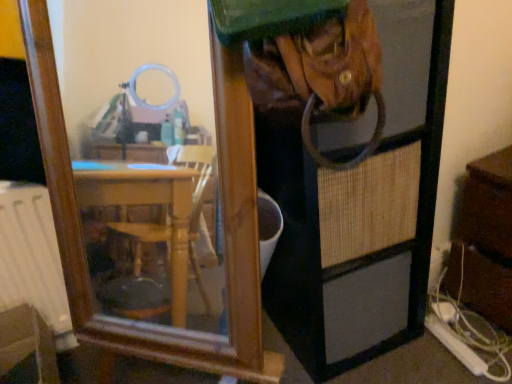
The image size is (512, 384). In order to click on brown wooden dresser at right in this screenshot , I will do `click(484, 240)`.

Measure the distance between brown wooden dresser at right and camera.

brown wooden dresser at right and camera are 1.22 meters apart.

Identify the location of brown woven screen door at center. (351, 175).

This screenshot has width=512, height=384. Identify the location of brown wooden dresser at right. (484, 240).

This screenshot has width=512, height=384. In the image, there is a brown woven screen door at center. What are the coordinates of `dresser below it (from the image's perspective)` in the screenshot? It's located at (484, 240).

From the picture: Is brown woven screen door at center positioned beyond the bounds of brown wooden dresser at right?

Absolutely, brown woven screen door at center is external to brown wooden dresser at right.

Is brown woven screen door at center aimed at brown wooden dresser at right?

No, brown woven screen door at center is not aimed at brown wooden dresser at right.

From a real-world perspective, between brown woven screen door at center and brown wooden dresser at right, who is vertically higher?

From a 3D spatial view, brown woven screen door at center is above.

Is brushed metal water at lower left aimed at brown wooden dresser at right?

No, brushed metal water at lower left is not turned towards brown wooden dresser at right.

From a real-world perspective, which object rests below the other?

brushed metal water at lower left, from a real-world perspective.

Find the location of a particular element. The image size is (512, 384). furniture below the brown wooden dresser at right (from the image's perspective) is located at coordinates (26, 347).

How many degrees apart are the facing directions of brushed metal water at lower left and brown wooden dresser at right?

brushed metal water at lower left and brown wooden dresser at right are facing 89.1 degrees away from each other.

Is brown wooden dresser at right oriented away from brown woven screen door at center?

No, brown wooden dresser at right is not facing away from brown woven screen door at center.

Considering the relative sizes of brown wooden dresser at right and brown woven screen door at center in the image provided, is brown wooden dresser at right wider than brown woven screen door at center?

Correct, the width of brown wooden dresser at right exceeds that of brown woven screen door at center.

From the image's perspective, between brown wooden dresser at right and brown woven screen door at center, which one is located above?

brown woven screen door at center appears higher in the image.

Are brown wooden dresser at right and brown woven screen door at center located far from each other?

No, brown wooden dresser at right is not far from brown woven screen door at center.

Does point (41, 378) appear closer or farther from the camera than point (318, 79)?

Clearly, point (41, 378) is more distant from the camera than point (318, 79).

Locate an element on the screen. The width and height of the screenshot is (512, 384). furniture below the brown woven screen door at center (from the image's perspective) is located at coordinates (26, 347).

Is the position of brushed metal water at lower left more distant than that of brown woven screen door at center?

That is True.

From the image's perspective, is brushed metal water at lower left on brown woven screen door at center?

Actually, brushed metal water at lower left appears below brown woven screen door at center in the image.

Is brown woven screen door at center situated inside brushed metal water at lower left or outside?

brown woven screen door at center exists outside the volume of brushed metal water at lower left.

Which of these two, brown woven screen door at center or brushed metal water at lower left, is bigger?

brown woven screen door at center.

Based on the photo, how many degrees apart are the facing directions of brown woven screen door at center and brushed metal water at lower left?

They differ by 5.26 degrees in their facing directions.

Between brown woven screen door at center and brushed metal water at lower left, which one has larger width?

Wider between the two is brushed metal water at lower left.

Is brown wooden dresser at right touching brushed metal water at lower left?

No, brown wooden dresser at right is not touching brushed metal water at lower left.

Which is more to the right, brown wooden dresser at right or brushed metal water at lower left?

brown wooden dresser at right.

From a real-world perspective, between brown wooden dresser at right and brushed metal water at lower left, who is vertically lower?

brushed metal water at lower left is physically lower.

Is brown wooden dresser at right not inside brushed metal water at lower left?

That's correct, brown wooden dresser at right is outside of brushed metal water at lower left.

The height and width of the screenshot is (384, 512). In the image, there is a brown woven screen door at center. What are the coordinates of `dresser below it (from the image's perspective)` in the screenshot? It's located at (484, 240).

You are a GUI agent. You are given a task and a screenshot of the screen. Output one action in this format:
    pyautogui.click(x=<x>, y=<y>)
    Task: Click on the dresser lying on the right of brushed metal water at lower left
    
    Given the screenshot: What is the action you would take?
    pyautogui.click(x=484, y=240)

Estimate the real-world distances between objects in this image. Which object is closer to brushed metal water at lower left, brown wooden dresser at right or brown woven screen door at center?

The object closer to brushed metal water at lower left is brown woven screen door at center.

Considering their positions, is brown wooden dresser at right positioned closer to brown woven screen door at center than brushed metal water at lower left?

Among the two, brown wooden dresser at right is located nearer to brown woven screen door at center.

Looking at the image, which one is located closer to brown woven screen door at center, brushed metal water at lower left or brown wooden dresser at right?

Among the two, brown wooden dresser at right is located nearer to brown woven screen door at center.

Estimate the real-world distances between objects in this image. Which object is further from brown wooden dresser at right, brown woven screen door at center or brushed metal water at lower left?

The object further to brown wooden dresser at right is brushed metal water at lower left.

Considering their positions, is brown woven screen door at center positioned closer to brushed metal water at lower left than brown wooden dresser at right?

Based on the image, brown woven screen door at center appears to be nearer to brushed metal water at lower left.

From the picture: Based on their spatial positions, is brushed metal water at lower left or brown woven screen door at center further from brown wooden dresser at right?

The object further to brown wooden dresser at right is brushed metal water at lower left.

I want to click on screen door between brushed metal water at lower left and brown wooden dresser at right from left to right, so click(x=351, y=175).